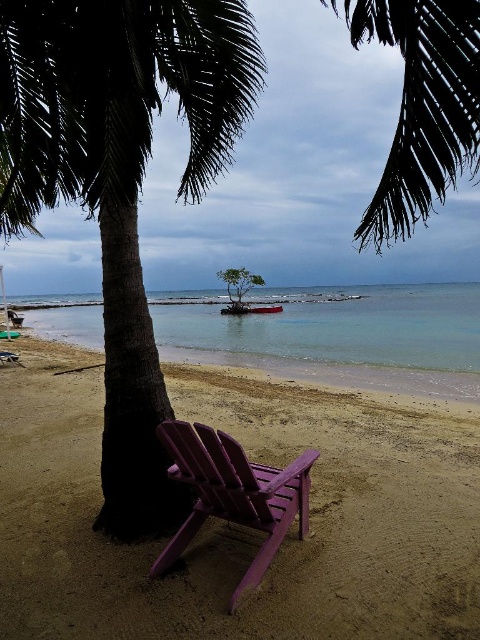
You are planning to set up a beach umbrella between the dark green leafy palm tree at center and the green leafy tree at center. Which tree should the umbrella be closer to if you want it to be under the taller tree?

The dark green leafy palm tree at center is taller than the green leafy tree at center, so the umbrella should be closer to the dark green leafy palm tree at center to be under the taller tree.

You are standing at the edge of the beach looking towards the turquoise waters. There is a point marked at coordinates (237, 525). What color would you see at that location?

The point at coordinates (237, 525) is sandy brown at lower center.